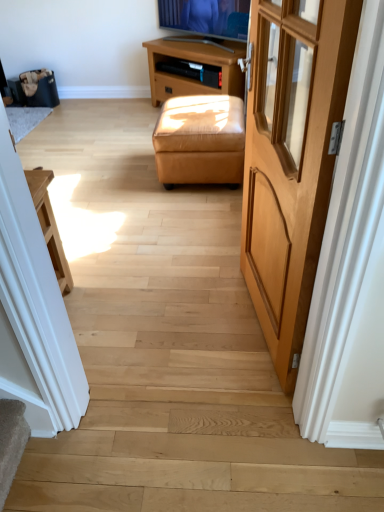
Locate an element on the screen. The width and height of the screenshot is (384, 512). vacant space that is to the left of light brown wood door at right is located at coordinates (177, 317).